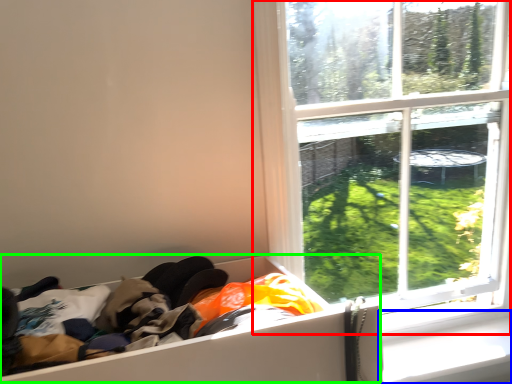
Question: Considering the real-world distances, which object is closest to window (highlighted by a red box)? window sill (highlighted by a blue box) or storage box (highlighted by a green box).

Choices:
 (A) window sill
 (B) storage box

Answer: (A)